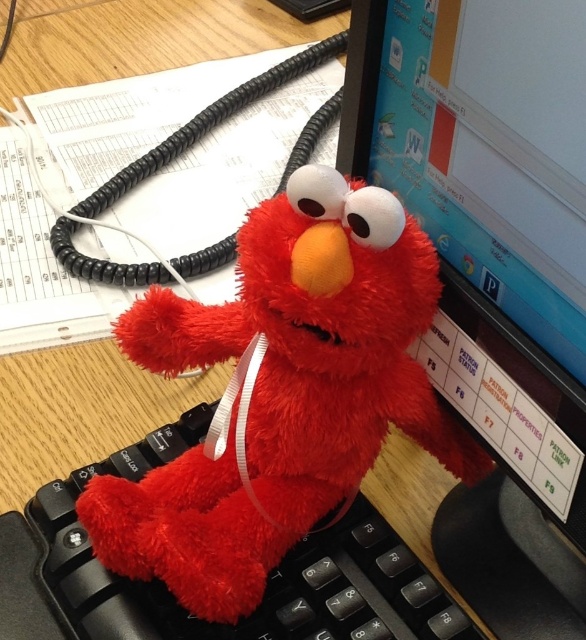
Does fluffy red plush toy at center have a greater height compared to black plastic keyboard at center?

Yes, fluffy red plush toy at center is taller than black plastic keyboard at center.

Who is higher up, fluffy red plush toy at center or black plastic keyboard at center?

Positioned higher is fluffy red plush toy at center.

Is point (127, 538) less distant than point (9, 561)?

Yes, it is.

At what (x,y) coordinates should I click in order to perform the action: click on fluffy red plush toy at center. Please return your answer as a coordinate pair (x, y). This screenshot has width=586, height=640. Looking at the image, I should click on (281, 394).

Is matte plastic monitor at upper right thinner than black plastic keyboard at center?

Yes.

Identify the location of matte plastic monitor at upper right. Image resolution: width=586 pixels, height=640 pixels. (492, 269).

Locate an element on the screen. The image size is (586, 640). matte plastic monitor at upper right is located at coordinates [x=492, y=269].

Is point (523, 618) closer to camera compared to point (175, 552)?

No, (523, 618) is further to viewer.

Between matte plastic monitor at upper right and fluffy red plush toy at center, which one is positioned higher?

matte plastic monitor at upper right is above.

Is point (573, 461) more distant than point (182, 524)?

No, it is not.

Where is `matte plastic monitor at upper right`? The width and height of the screenshot is (586, 640). matte plastic monitor at upper right is located at coordinates (492, 269).